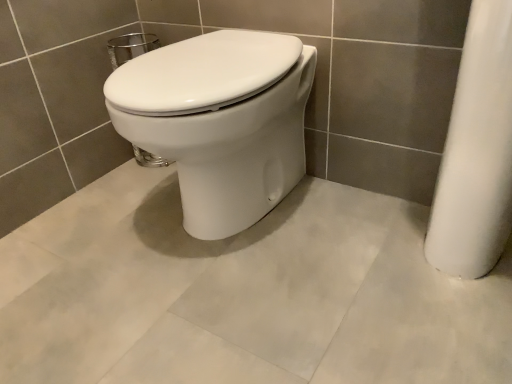
Image resolution: width=512 pixels, height=384 pixels. Find the location of `vacant space positioned to the left of white glossy toilet at center`. vacant space positioned to the left of white glossy toilet at center is located at coordinates (89, 224).